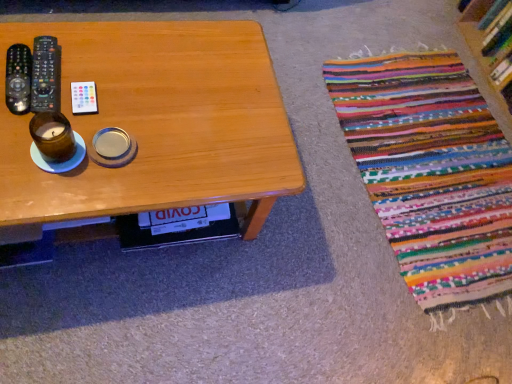
Identify the location of free spot to the right of white plastic remote control at upper left, the third remote control when ordered from left to right. The image size is (512, 384). (147, 121).